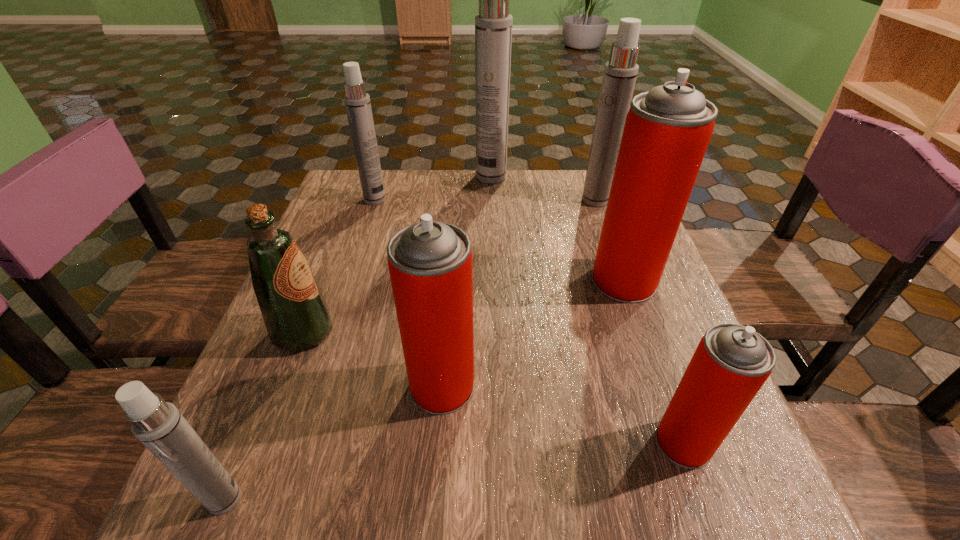
I want to click on unoccupied position between the rightmost white aerosol can and the leftmost red aerosol can, so click(x=518, y=293).

Find the location of `the fourth closest object to the fifth nearest object`. the fourth closest object to the fifth nearest object is located at coordinates (493, 25).

The image size is (960, 540). In order to click on the sixth closest object to the second biggest white aerosol can in this screenshot , I will do `click(295, 313)`.

Identify the location of aerosol can that stands as the third closest to the seventh farthest object. (158, 425).

Locate an element on the screen. The width and height of the screenshot is (960, 540). aerosol can that stands as the closest to the smallest red aerosol can is located at coordinates (667, 130).

At what (x,y) coordinates should I click in order to perform the action: click on the fourth closest white aerosol can to the green olive oil. Please return your answer as a coordinate pair (x, y). Looking at the image, I should click on (620, 73).

Locate an element on the screen. The image size is (960, 540). the closest white aerosol can to the fourth nearest object is located at coordinates (158, 425).

Identify which red aerosol can is the second nearest to the fourth farthest aerosol can. Please provide its 2D coordinates. Your answer should be formatted as a tuple, i.e. [(x, y)], where the tuple contains the x and y coordinates of a point satisfying the conditions above.

[(430, 263)]

This screenshot has width=960, height=540. I want to click on the second closest red aerosol can to the second biggest white aerosol can, so click(430, 263).

Locate an element on the screen. This screenshot has width=960, height=540. free spot that satisfies the following two spatial constraints: 1. on the front-facing side of the third nearest object; 2. on the right side of the fourth nearest object is located at coordinates (282, 386).